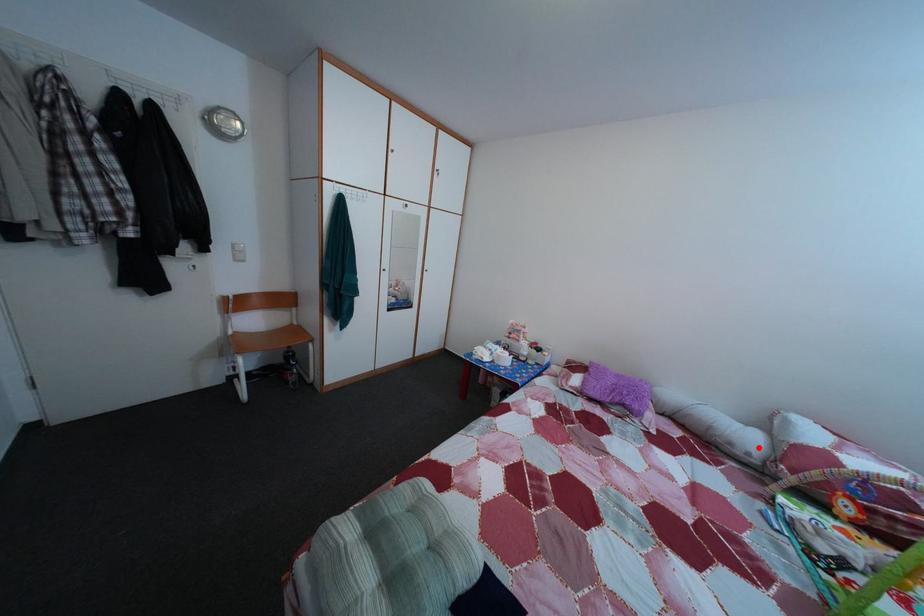
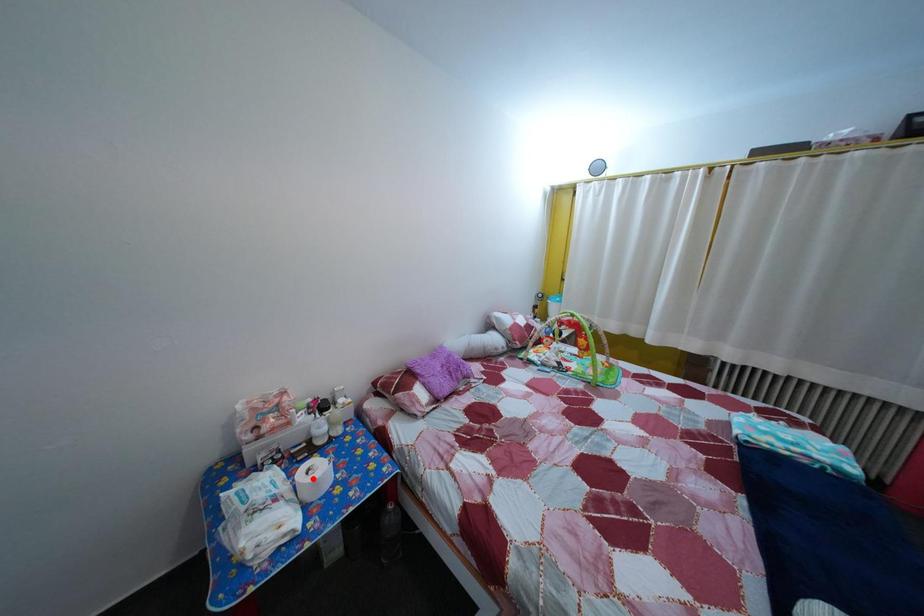
I am providing you with two images of the same scene from different viewpoints. A red point is marked on the first image and another point is marked on the second image. Is the red point in image1 aligned with the point shown in image2?

No